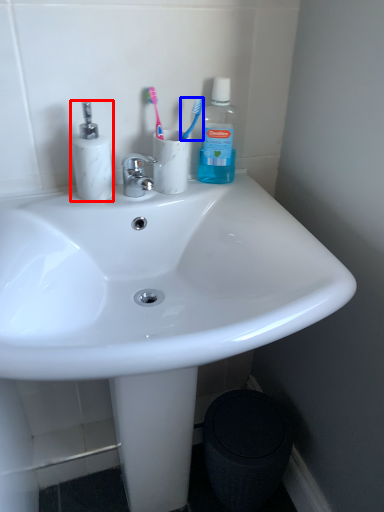
Question: Which object appears closest to the camera in this image, toiletries (highlighted by a red box) or toothbrush (highlighted by a blue box)?

Choices:
 (A) toiletries
 (B) toothbrush

Answer: (A)